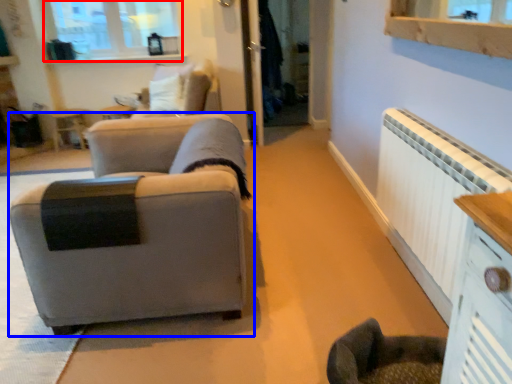
Question: Which object is closer to the camera taking this photo, window (highlighted by a red box) or studio couch (highlighted by a blue box)?

Choices:
 (A) window
 (B) studio couch

Answer: (B)